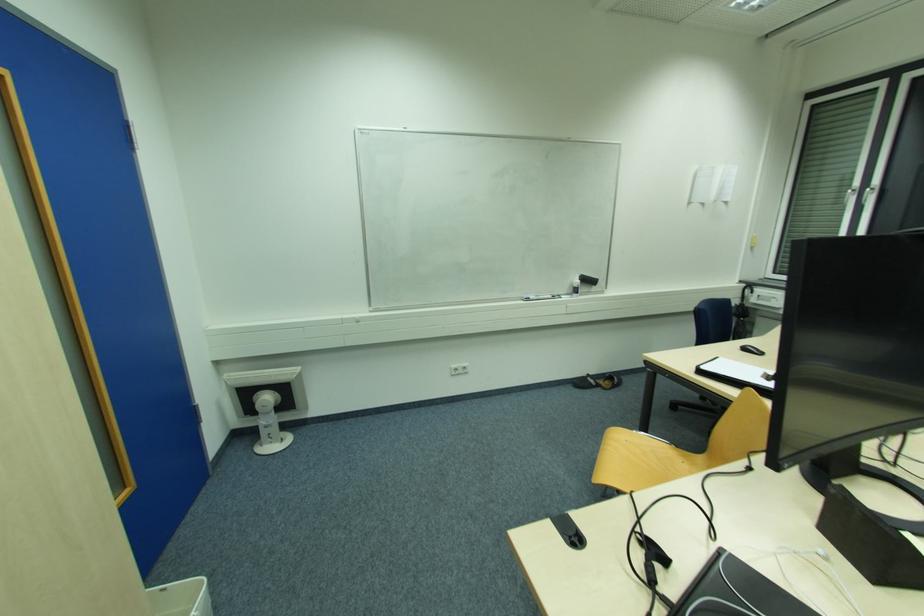
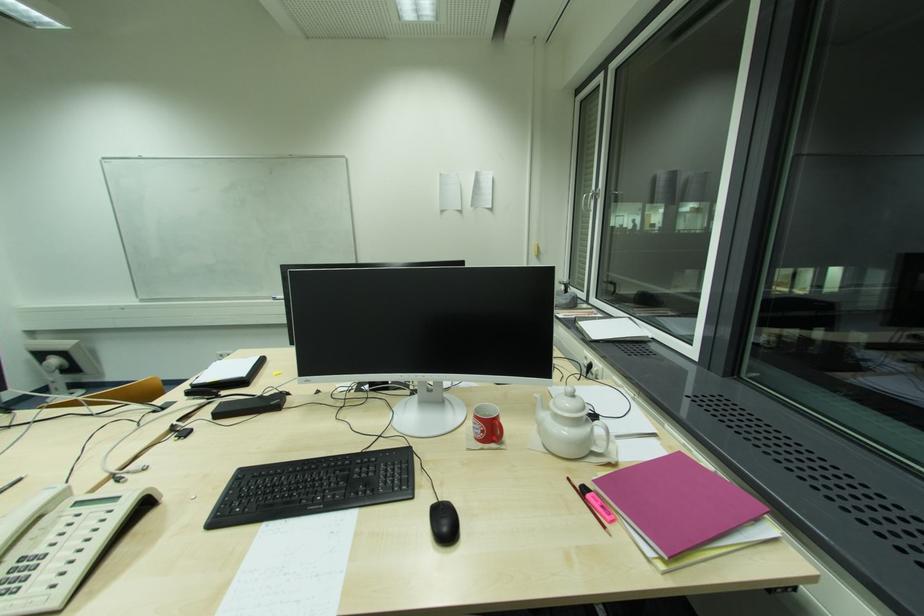
Question: The images are taken continuously from a first-person perspective. In which direction are you moving?

Choices:
 (A) Left
 (B) Right
 (C) Forward
 (D) Backward

Answer: (B)